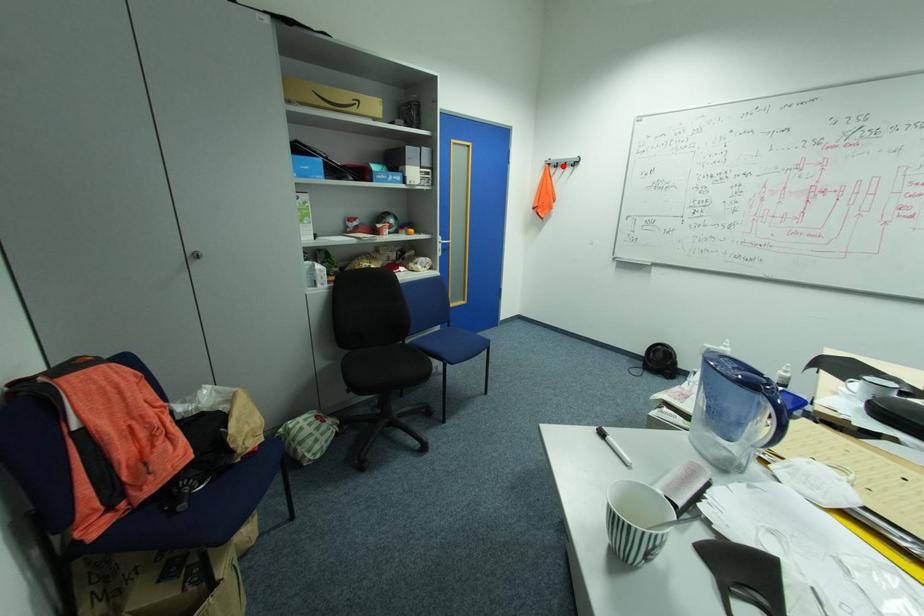
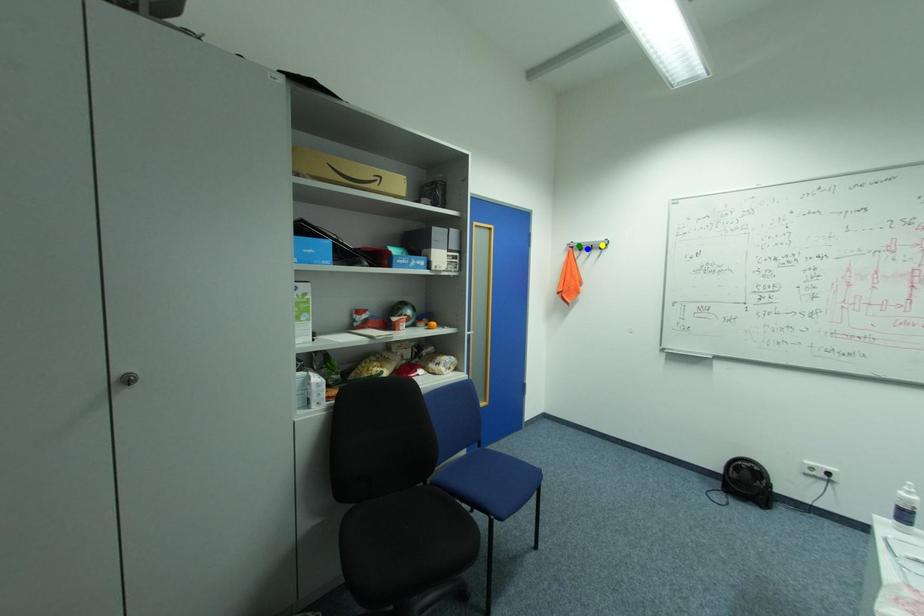
Question: I am providing you with two images of the same scene from different viewpoints. A red point is marked on the first image. You are given multiple points on the second image. Which point in image 2 represents the same 3d spot as the red point in image 1?

Choices:
 (A) green point
 (B) blue point
 (C) yellow point

Answer: (B)